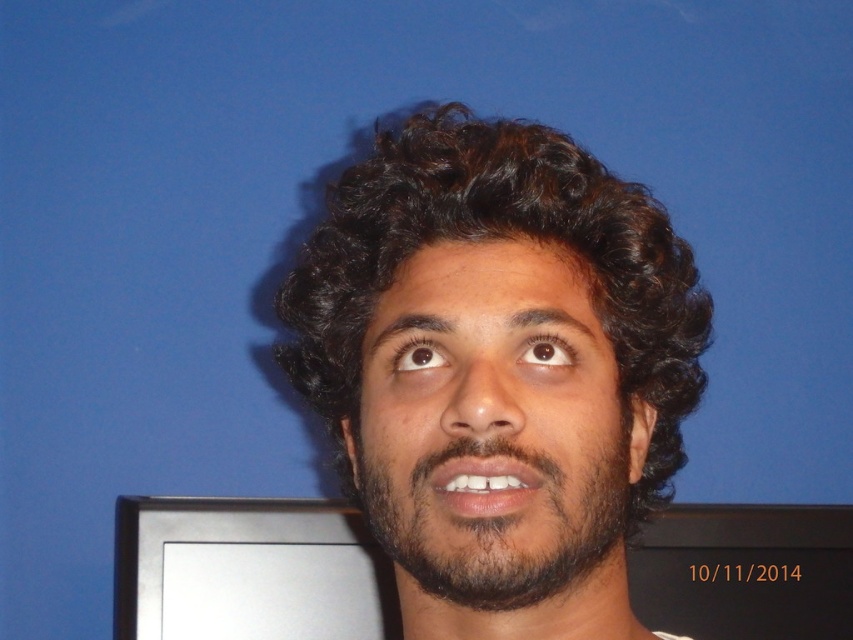
Which is in front, point (431, 161) or point (541, 557)?

Positioned in front is point (541, 557).

Who is higher up, dark brown curly hair at center or dark brown fuzzy beard at center?

dark brown curly hair at center

Where is `dark brown curly hair at center`? dark brown curly hair at center is located at coordinates (498, 369).